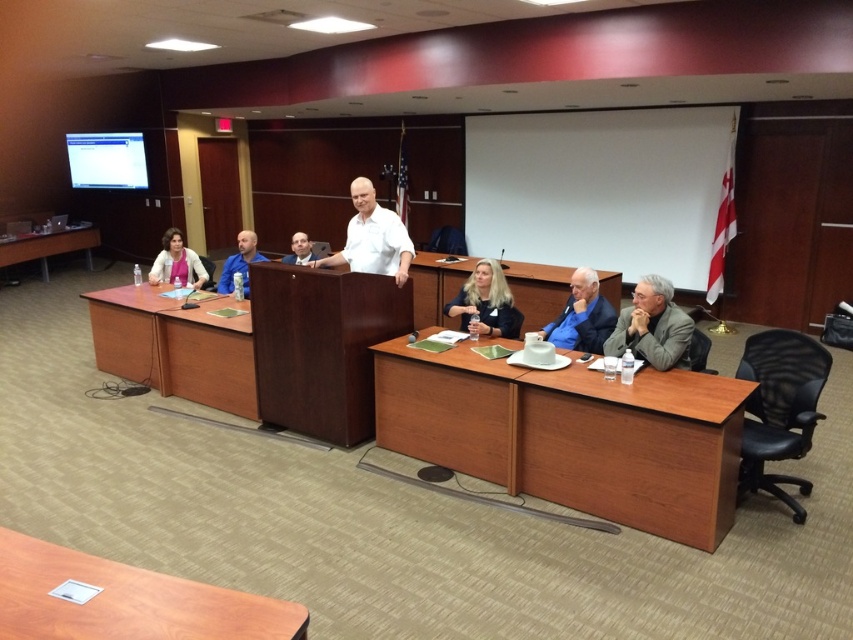
Who is higher up, blue shirt at center or matte black shirt at center?

Positioned higher is matte black shirt at center.

Does point (247, 244) come farther from viewer compared to point (288, 257)?

No, (247, 244) is in front of (288, 257).

The height and width of the screenshot is (640, 853). What are the coordinates of `blue shirt at center` in the screenshot? It's located at (239, 262).

Can you confirm if gray fabric suit at lower right is positioned above blue shirt at center?

No.

Between gray fabric suit at lower right and blue shirt at center, which one is positioned lower?

Positioned lower is gray fabric suit at lower right.

Does point (635, 305) lie in front of point (231, 256)?

Yes, point (635, 305) is in front of point (231, 256).

Where is `gray fabric suit at lower right`? The width and height of the screenshot is (853, 640). gray fabric suit at lower right is located at coordinates (651, 324).

Is brown wood table at lower left wider than matte pink blouse at left?

Correct, the width of brown wood table at lower left exceeds that of matte pink blouse at left.

Is point (74, 234) positioned in front of point (172, 228)?

That is False.

Does point (13, 246) come in front of point (167, 234)?

No, it is behind (167, 234).

In order to click on brown wood table at lower left in this screenshot , I will do `click(49, 246)`.